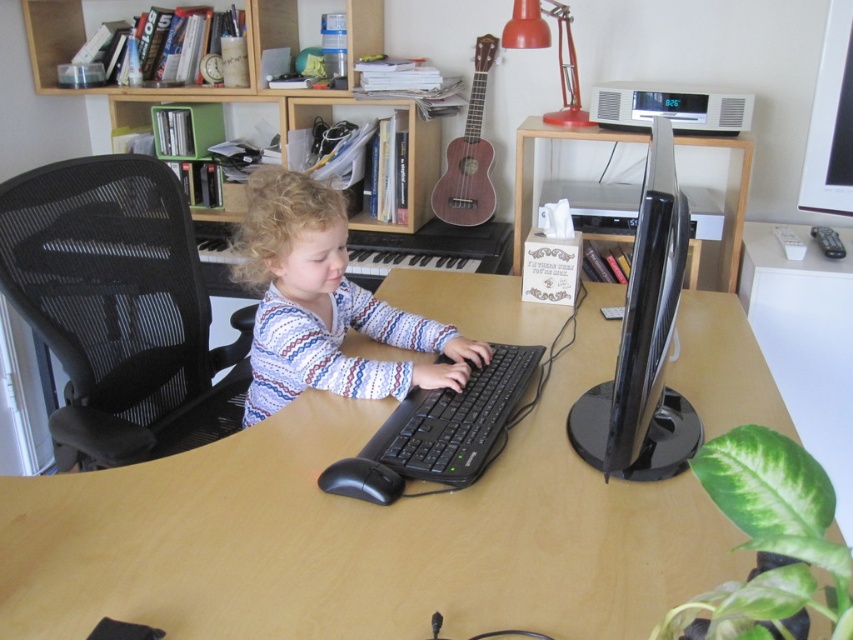
Question: Which of the following is the farthest from the observer?

Choices:
 (A) (328, 481)
 (B) (705, 324)

Answer: (B)

Question: From the image, what is the correct spatial relationship of black glossy monitor at center right in relation to black matte mouse at center?

Choices:
 (A) below
 (B) above

Answer: (B)

Question: Among these points, which one is farthest from the camera?

Choices:
 (A) (303, 509)
 (B) (407, 316)

Answer: (B)

Question: Is black glossy monitor at center right further to camera compared to black matte mouse at center?

Choices:
 (A) no
 (B) yes

Answer: (A)

Question: Which point is farther to the camera?

Choices:
 (A) pyautogui.click(x=489, y=403)
 (B) pyautogui.click(x=635, y=385)

Answer: (A)

Question: Is white textured sweater at center positioned at the back of black glossy monitor at upper right?

Choices:
 (A) yes
 (B) no

Answer: (B)